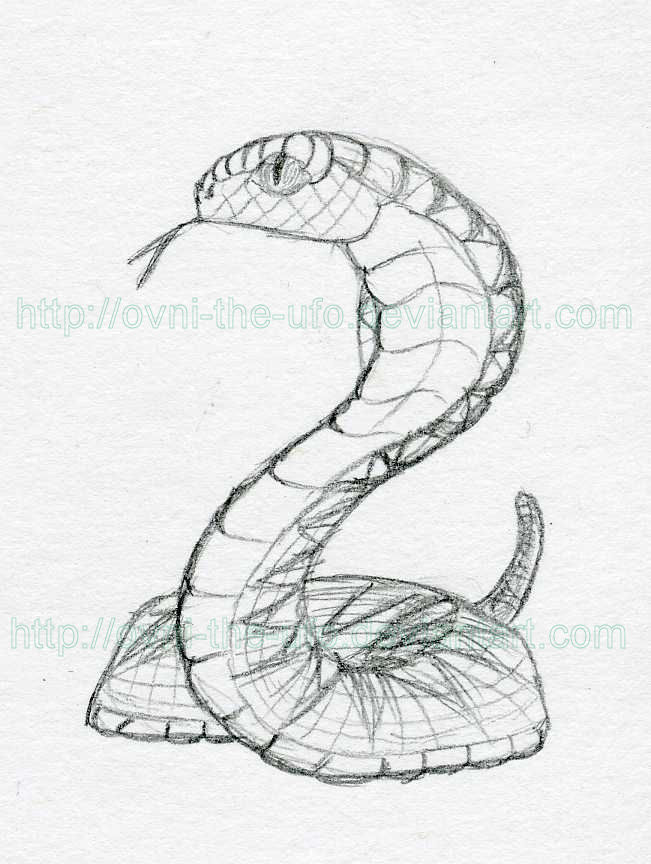
Find the location of a particular element. The image size is (651, 864). scales is located at coordinates (506, 356), (395, 626), (490, 748).